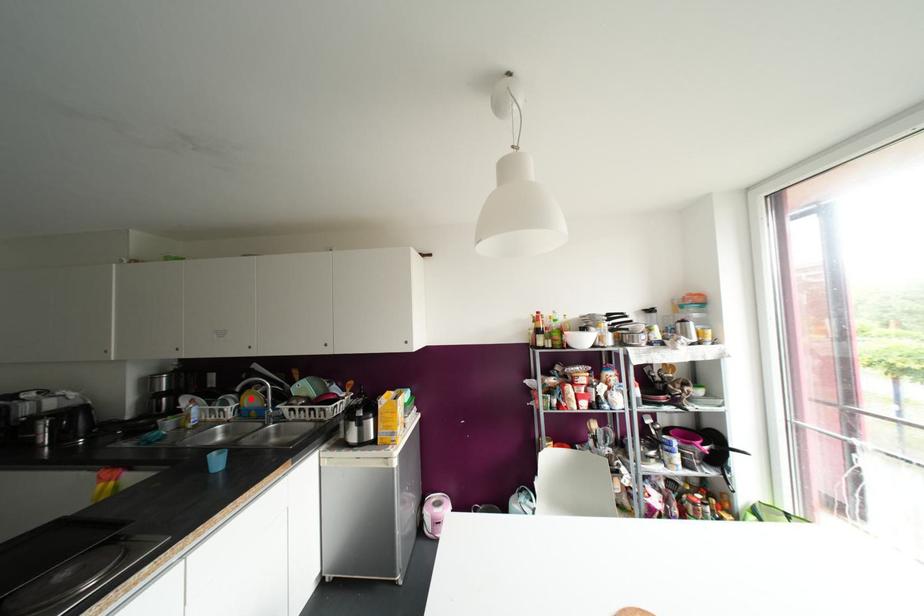
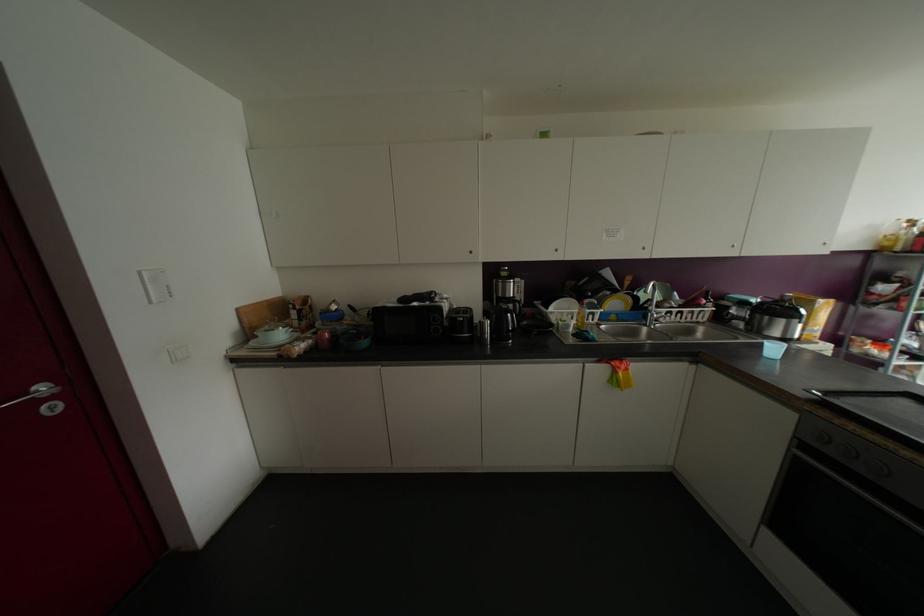
Find the pixel in the second image that matches the highlighted location in the first image.

(614, 302)